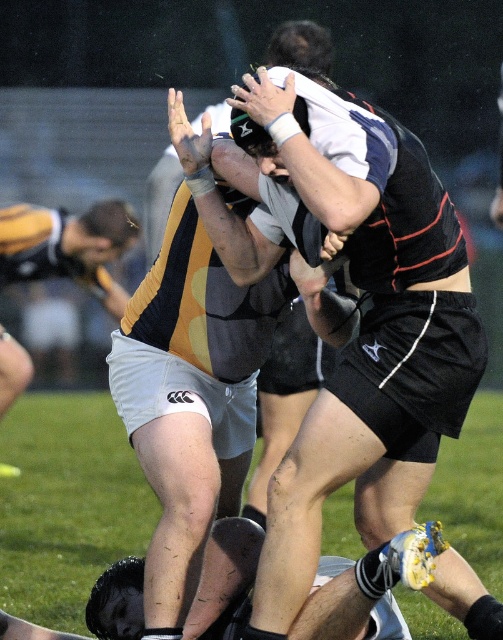
Does black jersey at center have a smaller size compared to white matte shorts at center?

No.

Measure the distance from black jersey at center to white matte shorts at center.

The distance of black jersey at center from white matte shorts at center is 50.54 centimeters.

Does point (342, 129) come behind point (123, 348)?

No, (342, 129) is closer to viewer.

You are a GUI agent. You are given a task and a screenshot of the screen. Output one action in this format:
    pyautogui.click(x=<x>, y=<y>)
    Task: Click on the black jersey at center
    The image size is (503, 640).
    Given the screenshot: What is the action you would take?
    pyautogui.click(x=363, y=320)